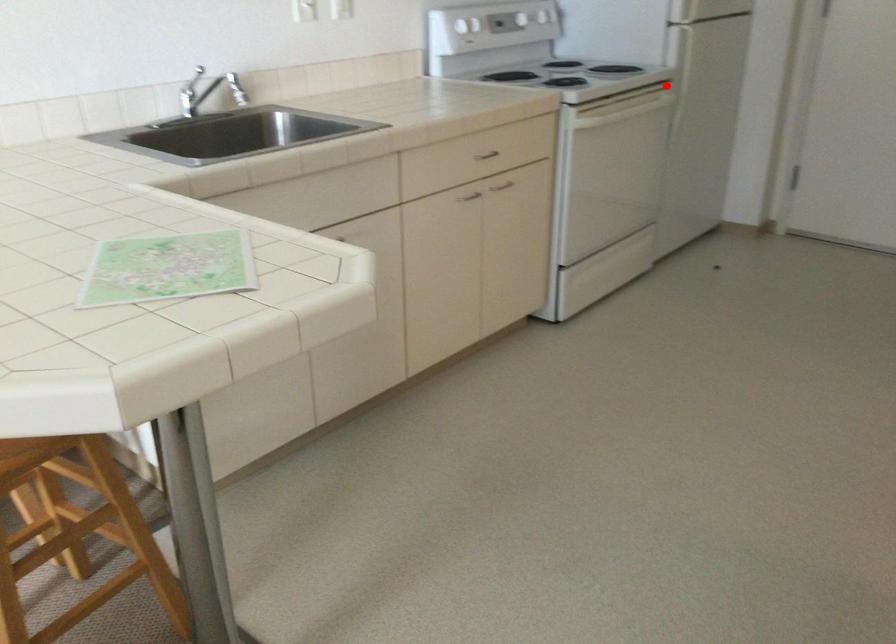
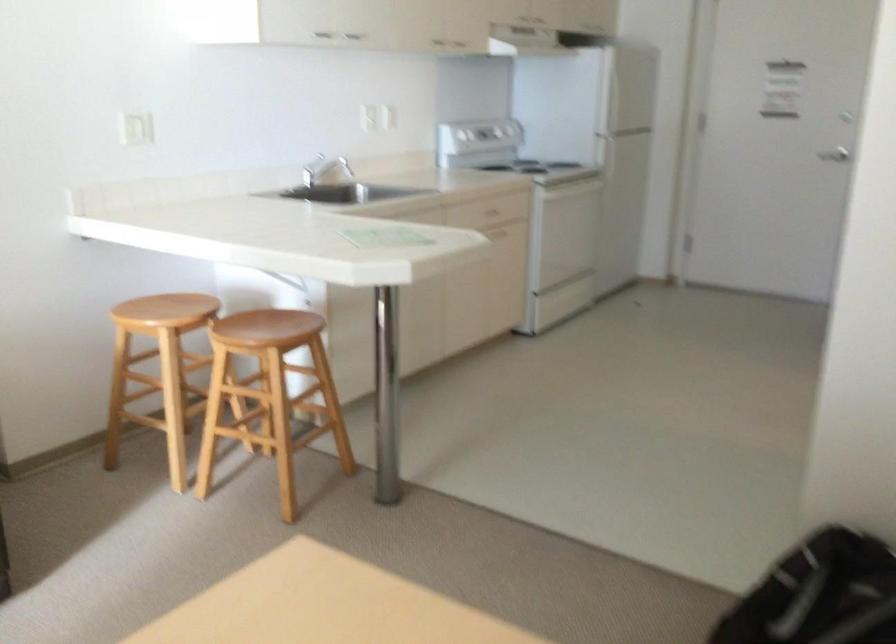
Locate, in the second image, the point that corresponds to the highlighted location in the first image.

(606, 164)